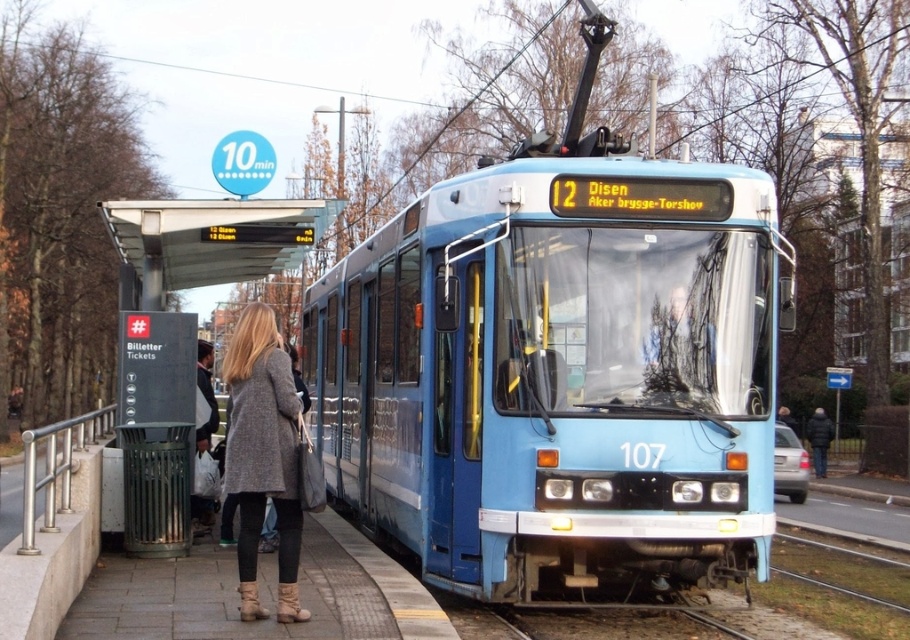
Question: Does metallic gray ticket machine at lower left appear on the left side of white plastic bag at center?

Choices:
 (A) no
 (B) yes

Answer: (B)

Question: Which point is closer to the camera?

Choices:
 (A) (150, 292)
 (B) (359, 376)
 (C) (241, 580)
 (D) (209, 417)

Answer: (C)

Question: Among these objects, which one is farthest from the camera?

Choices:
 (A) white plastic bag at center
 (B) blue metallic train at center
 (C) metallic gray ticket machine at lower left

Answer: (C)

Question: Which object is farther from the camera taking this photo?

Choices:
 (A) metallic gray ticket machine at lower left
 (B) blue metallic train at center
 (C) white plastic bag at center
 (D) gray wool coat at center

Answer: (A)

Question: Is blue metallic train at center further to camera compared to metallic gray ticket machine at lower left?

Choices:
 (A) no
 (B) yes

Answer: (A)

Question: Can you confirm if gray wool coat at center is wider than metallic gray ticket machine at lower left?

Choices:
 (A) no
 (B) yes

Answer: (A)